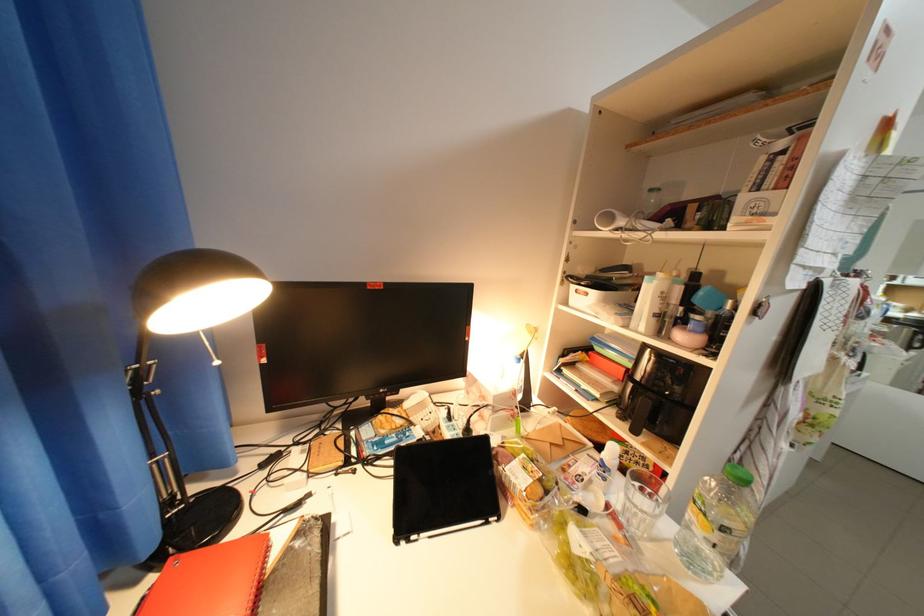
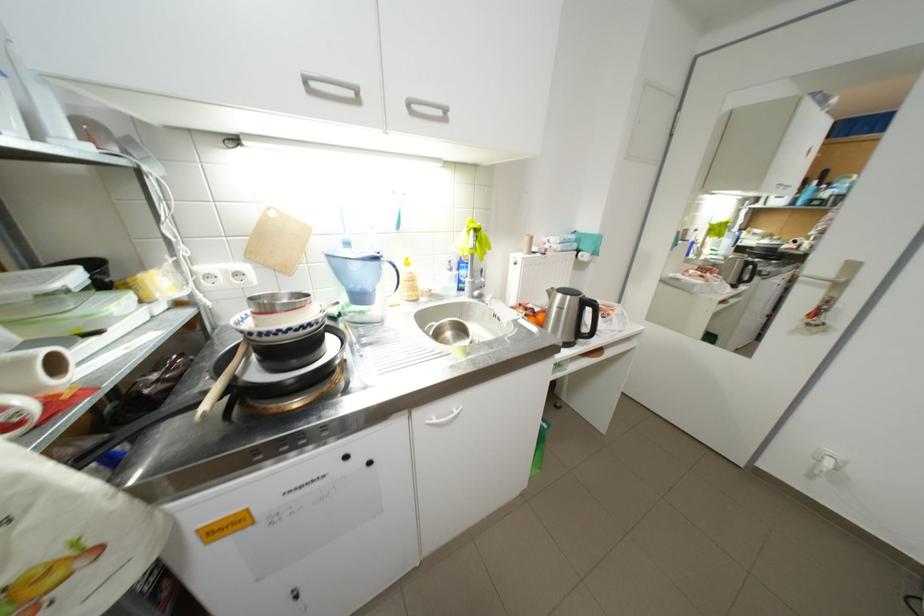
Question: What movement of the cameraman would produce the second image?

Choices:
 (A) Left
 (B) Right
 (C) Forward
 (D) Backward

Answer: (B)